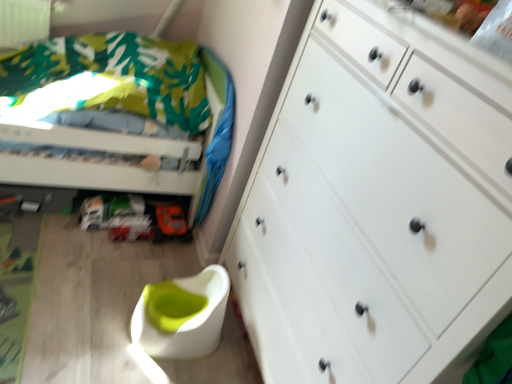
Question: From the image's perspective, is white matte chest of drawers at right above white plastic swivel chair at lower center?

Choices:
 (A) no
 (B) yes

Answer: (B)

Question: Can you confirm if white matte chest of drawers at right is smaller than white plastic swivel chair at lower center?

Choices:
 (A) no
 (B) yes

Answer: (A)

Question: Does white matte chest of drawers at right lie in front of white plastic swivel chair at lower center?

Choices:
 (A) yes
 (B) no

Answer: (A)

Question: Is white matte chest of drawers at right oriented away from white plastic swivel chair at lower center?

Choices:
 (A) no
 (B) yes

Answer: (A)

Question: From a real-world perspective, is white matte chest of drawers at right over white plastic swivel chair at lower center?

Choices:
 (A) yes
 (B) no

Answer: (A)

Question: Is white plastic swivel chair at lower center to the left or to the right of orange matte toy car at lower center in the image?

Choices:
 (A) right
 (B) left

Answer: (A)

Question: Does point (182, 314) appear closer or farther from the camera than point (128, 211)?

Choices:
 (A) closer
 (B) farther

Answer: (A)

Question: From a real-world perspective, relative to orange matte toy car at lower center, is white plastic swivel chair at lower center vertically above or below?

Choices:
 (A) below
 (B) above

Answer: (B)

Question: Considering the positions of white plastic swivel chair at lower center and orange matte toy car at lower center in the image, is white plastic swivel chair at lower center wider or thinner than orange matte toy car at lower center?

Choices:
 (A) wide
 (B) thin

Answer: (A)

Question: From their relative heights in the image, would you say white plastic swivel chair at lower center is taller or shorter than green fabric bed at upper left?

Choices:
 (A) tall
 (B) short

Answer: (B)

Question: In terms of size, does white plastic swivel chair at lower center appear bigger or smaller than green fabric bed at upper left?

Choices:
 (A) small
 (B) big

Answer: (A)

Question: From a real-world perspective, is white plastic swivel chair at lower center above or below green fabric bed at upper left?

Choices:
 (A) below
 (B) above

Answer: (A)

Question: Considering the relative positions of white plastic swivel chair at lower center and green fabric bed at upper left in the image provided, is white plastic swivel chair at lower center to the left or to the right of green fabric bed at upper left?

Choices:
 (A) left
 (B) right

Answer: (B)

Question: Based on their positions, is white matte chest of drawers at right located to the left or right of green fabric bed at upper left?

Choices:
 (A) left
 (B) right

Answer: (B)

Question: From the image's perspective, is white matte chest of drawers at right above or below green fabric bed at upper left?

Choices:
 (A) above
 (B) below

Answer: (B)